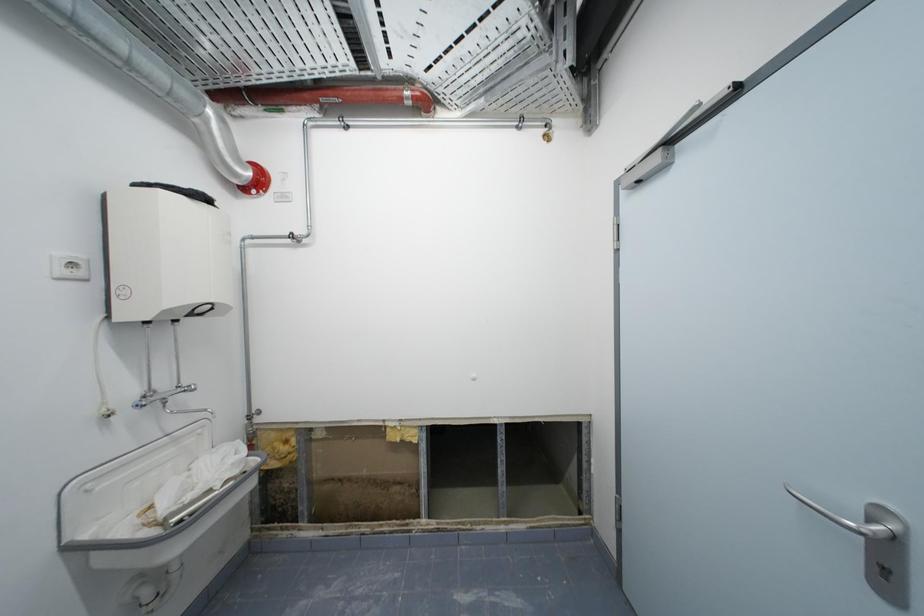
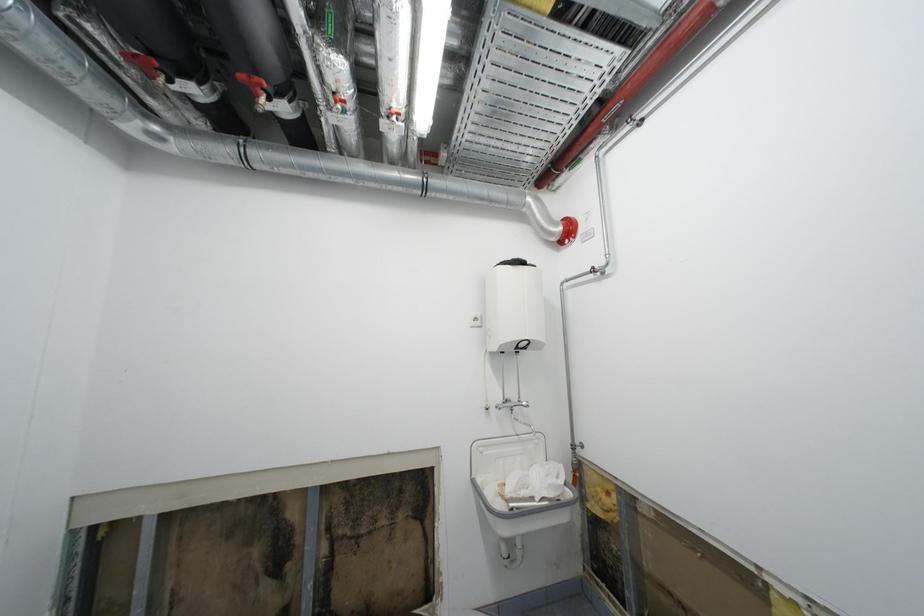
Question: The camera is either moving clockwise (left) or counter-clockwise (right) around the object. The first image is from the beginning of the video and the second image is from the end. Is the camera moving left or right when shooting the video?

Choices:
 (A) Left
 (B) Right

Answer: (B)